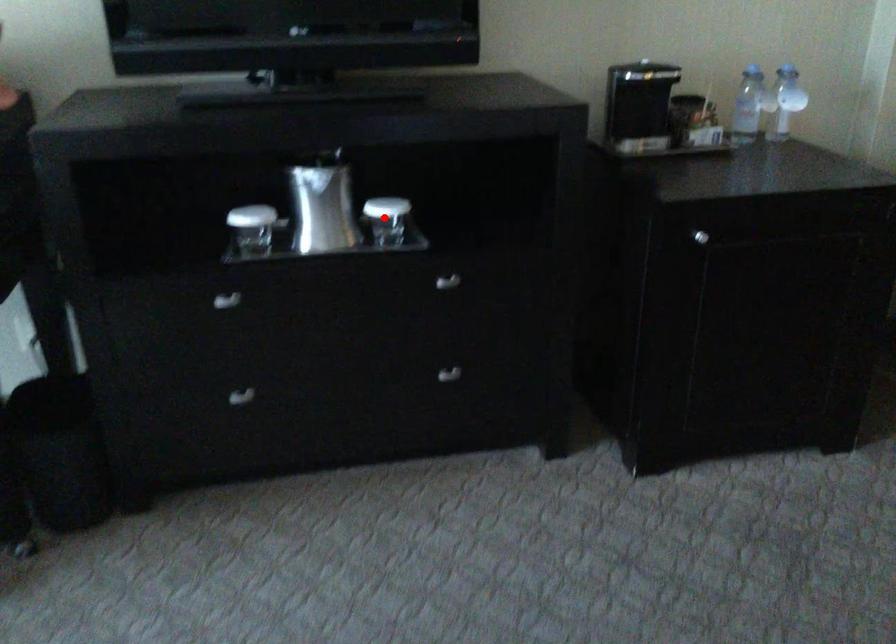
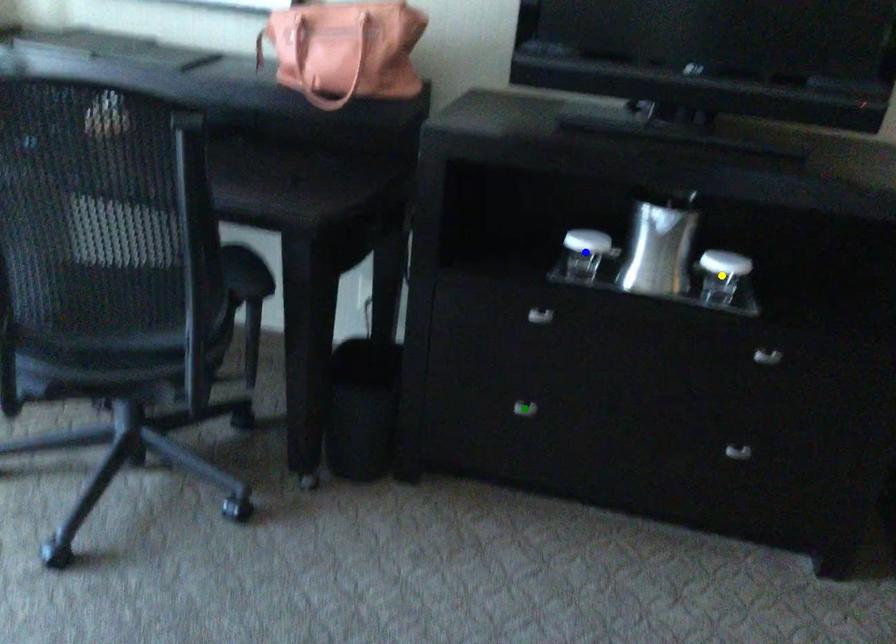
Question: I am providing you with two images of the same scene from different viewpoints. A red point is marked on the first image. You are given multiple points on the second image. Which point in image 2 represents the same 3d spot as the red point in image 1?

Choices:
 (A) blue point
 (B) green point
 (C) yellow point

Answer: (C)